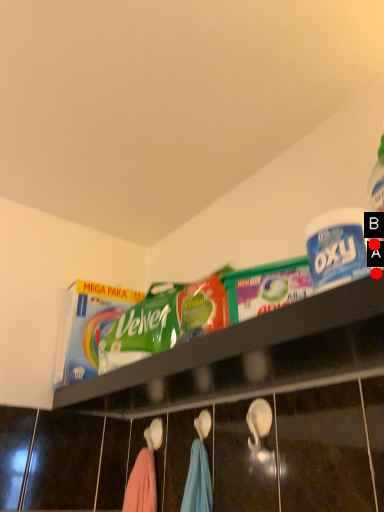
Question: Two points are circled on the image, labeled by A and B beside each circle. Among these points, which one is nearest to the camera?

Choices:
 (A) A is closer
 (B) B is closer

Answer: (A)